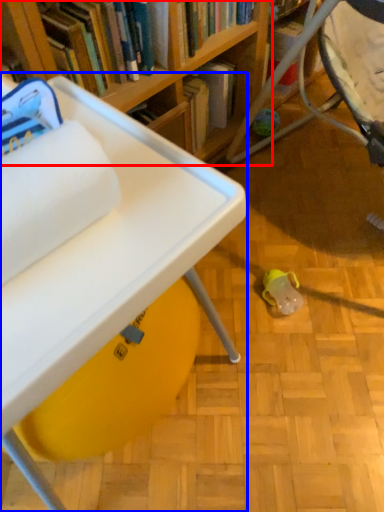
Question: Which object appears farthest to the camera in this image, bookcase (highlighted by a red box) or table (highlighted by a blue box)?

Choices:
 (A) bookcase
 (B) table

Answer: (A)